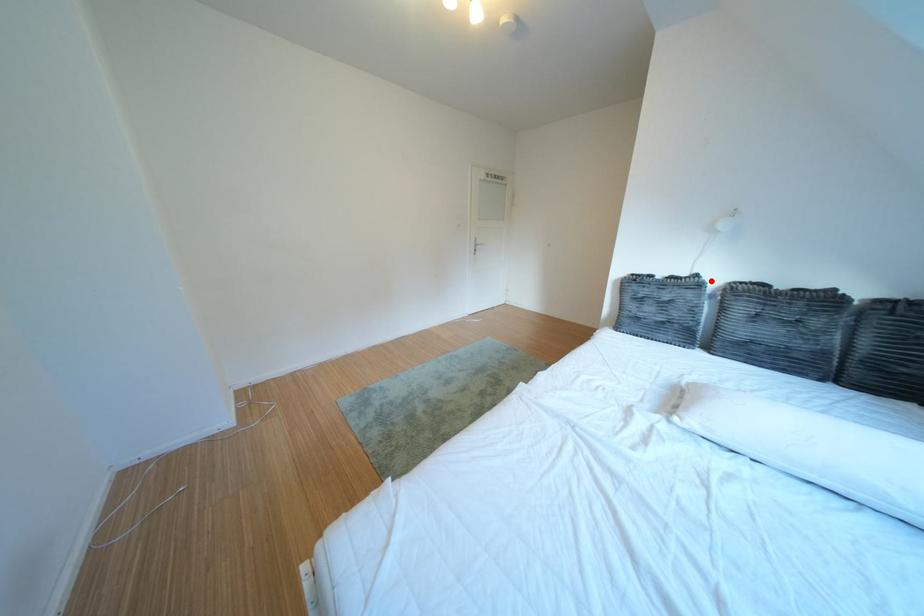
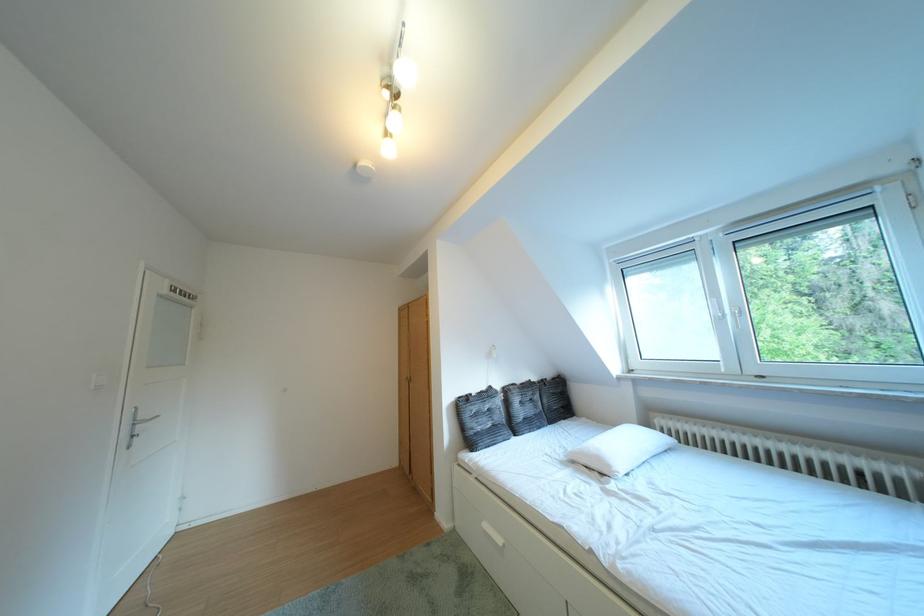
Locate, in the second image, the point that corresponds to the highlighted location in the first image.

(504, 392)